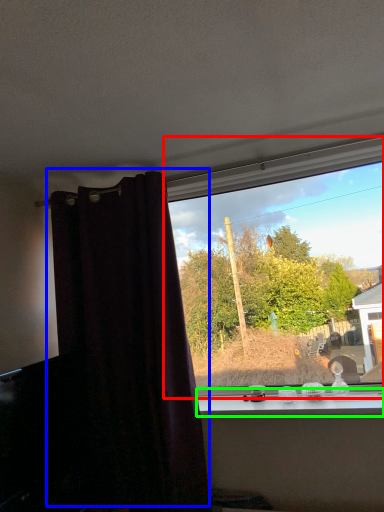
Question: Considering the real-world distances, which object is closest to window (highlighted by a red box)? curtain (highlighted by a blue box) or window sill (highlighted by a green box).

Choices:
 (A) curtain
 (B) window sill

Answer: (B)